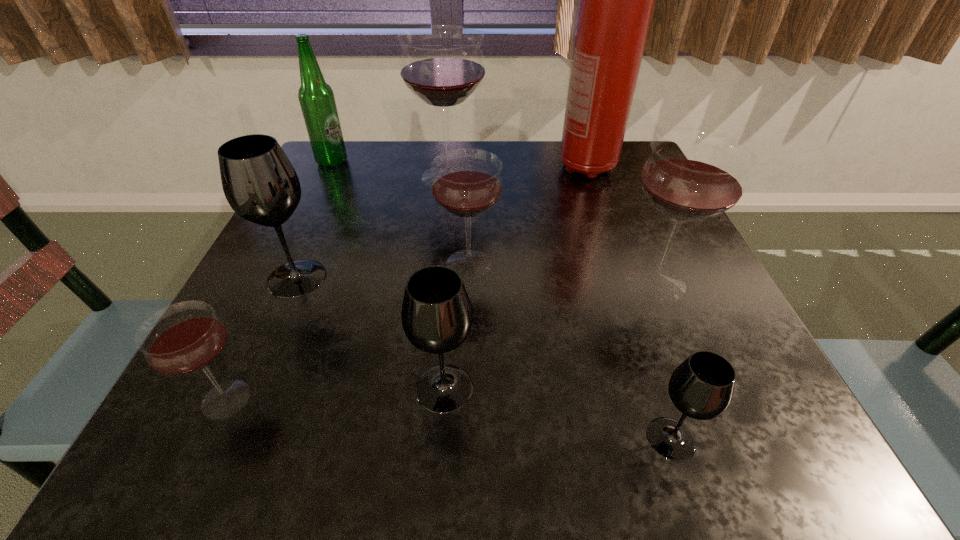
What are the coordinates of `free point that satisfies the following two spatial constraints: 1. on the label of the beer bottle; 2. on the left side of the smallest gray wineglass` in the screenshot? It's located at (194, 439).

What are the coordinates of `vacant area in the image that satisfies the following two spatial constraints: 1. on the label of the third biggest red wineglass; 2. on the right side of the green beer bottle` in the screenshot? It's located at (281, 264).